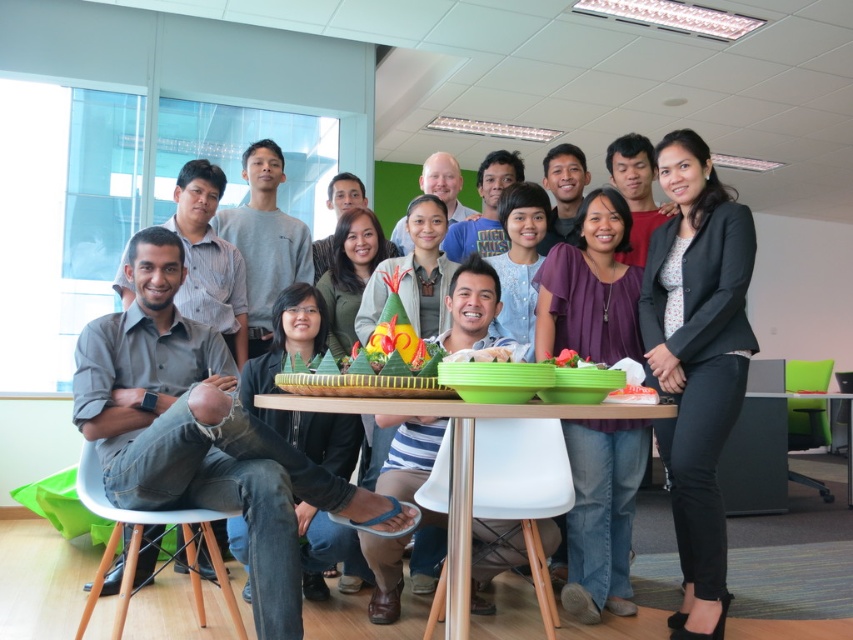
Question: Is green plastic table at center positioned in front of white plastic stool at lower left?

Choices:
 (A) yes
 (B) no

Answer: (A)

Question: Which object is positioned closest to the smooth plastic container at center?

Choices:
 (A) matte black shirt at center
 (B) white plastic stool at lower left
 (C) green plastic table at center

Answer: (C)

Question: Which point is closer to the camera?

Choices:
 (A) matte black shirt at center
 (B) green plastic table at center
 (C) smooth plastic container at center
 (D) white plastic stool at lower left

Answer: (B)

Question: Is matte black shirt at center positioned at the back of black matte blazer at upper right?

Choices:
 (A) no
 (B) yes

Answer: (B)

Question: Which point is closer to the camera?

Choices:
 (A) (115, 628)
 (B) (515, 404)
 (C) (706, 628)
 (D) (640, 326)

Answer: (B)

Question: Considering the relative positions of green plastic table at center and white plastic stool at lower left in the image provided, where is green plastic table at center located with respect to white plastic stool at lower left?

Choices:
 (A) right
 (B) left

Answer: (A)